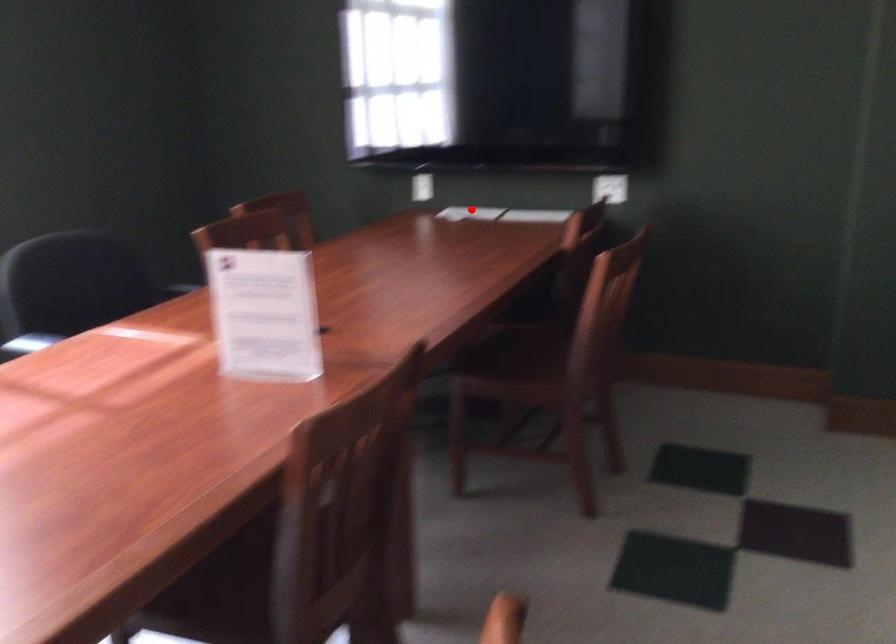
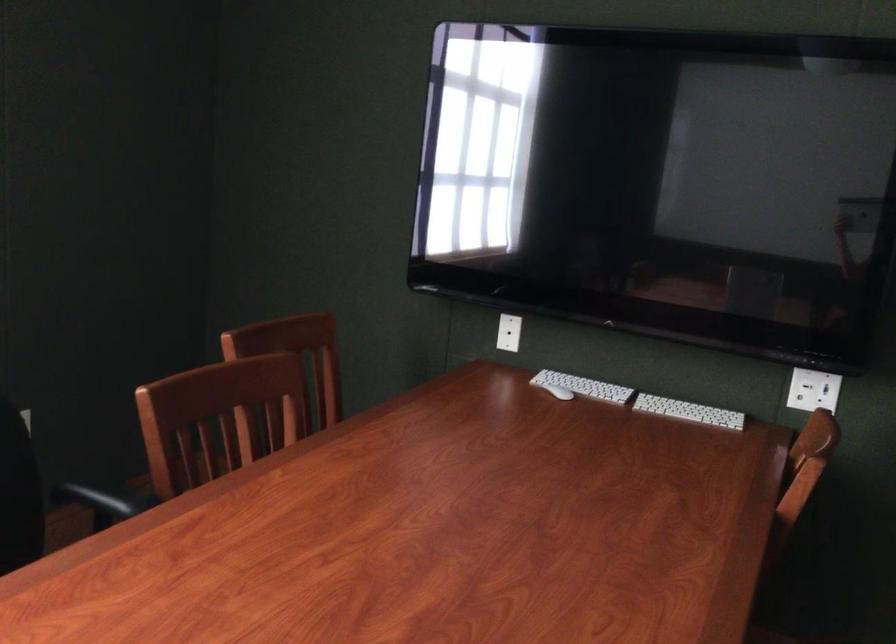
Question: I am providing you with two images of the same scene from different viewpoints. Given a red point in image1, look at the same physical point in image2. Is it:

Choices:
 (A) Closer to the viewpoint
 (B) Farther from the viewpoint

Answer: (A)